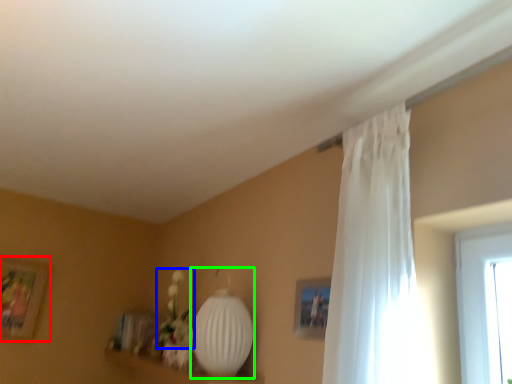
Question: Considering the real-world distances, which object is farthest from picture frame (highlighted by a red box)? floral arrangement (highlighted by a blue box) or lamp (highlighted by a green box)?

Choices:
 (A) floral arrangement
 (B) lamp

Answer: (B)